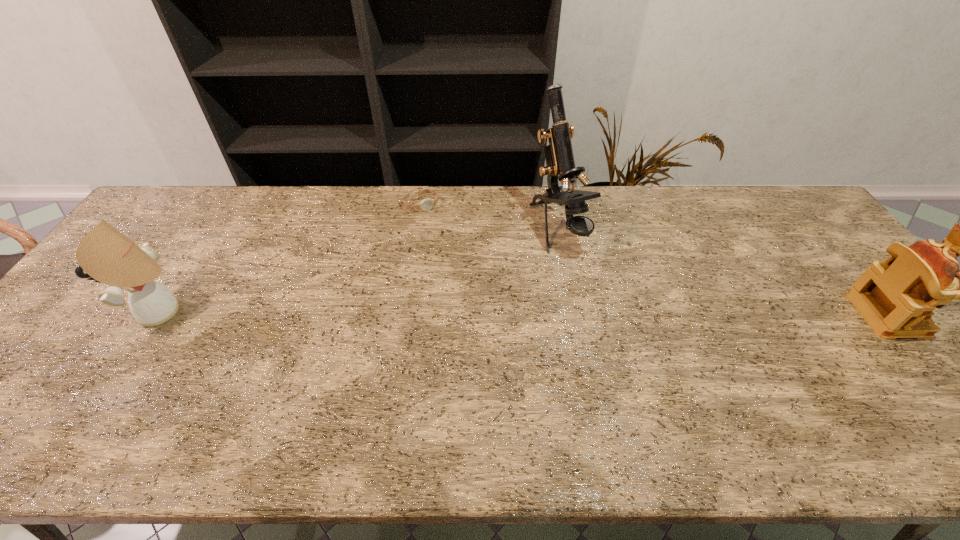
Find the location of a particular element. doll is located at coordinates (107, 256).

Identify the location of figurine. This screenshot has height=540, width=960. (896, 297).

This screenshot has height=540, width=960. In order to click on the tallest object in this screenshot , I will do `click(559, 157)`.

Find the location of a particular element. This screenshot has width=960, height=540. the second object from right to left is located at coordinates (559, 157).

Locate an element on the screen. The height and width of the screenshot is (540, 960). the shortest object is located at coordinates (426, 204).

The image size is (960, 540). Identify the location of the third object from right to left. (426, 204).

The height and width of the screenshot is (540, 960). In order to click on vacant space located at the front face of the doll in this screenshot , I will do `click(117, 312)`.

Locate an element on the screen. free space located at the front face of the doll is located at coordinates (80, 312).

The image size is (960, 540). I want to click on free space located at the front face of the doll, so click(91, 312).

I want to click on free spot located through the eyepiece of the second object from right to left, so click(597, 287).